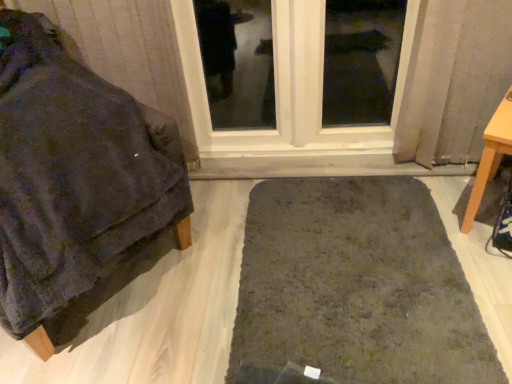
The image size is (512, 384). What do you see at coordinates (355, 286) in the screenshot?
I see `dark green shaggy rug at center` at bounding box center [355, 286].

This screenshot has width=512, height=384. What do you see at coordinates (490, 156) in the screenshot?
I see `light brown wooden table at right, the 2th furniture viewed from the left` at bounding box center [490, 156].

Describe the element at coordinates (73, 179) in the screenshot. I see `velvety dark gray blanket at left, positioned as the second furniture in right-to-left order` at that location.

Find the location of `clear glass window at center`. clear glass window at center is located at coordinates (288, 86).

From a real-world perspective, who is located lower, clear glass window at center or light brown wooden table at right, the 2th furniture viewed from the left?

Answer: light brown wooden table at right, the 2th furniture viewed from the left, is physically lower.

Is clear glass window at center in front of light brown wooden table at right, positioned as the first furniture in right-to-left order?

No, clear glass window at center is further to the viewer.

Considering the relative sizes of clear glass window at center and light brown wooden table at right, positioned as the first furniture in right-to-left order, in the image provided, is clear glass window at center taller than light brown wooden table at right, positioned as the first furniture in right-to-left order,?

Yes.

This screenshot has width=512, height=384. I want to click on window that is above the light brown wooden table at right, positioned as the first furniture in right-to-left order (from a real-world perspective), so click(x=288, y=86).

From the image's perspective, which one is positioned higher, dark green shaggy rug at center or velvety dark gray blanket at left, positioned as the second furniture in right-to-left order?

velvety dark gray blanket at left, positioned as the second furniture in right-to-left order, appears higher in the image.

Which object is thinner, dark green shaggy rug at center or velvety dark gray blanket at left, positioned as the second furniture in right-to-left order?

With smaller width is velvety dark gray blanket at left, positioned as the second furniture in right-to-left order.

Can you confirm if dark green shaggy rug at center is positioned to the right of velvety dark gray blanket at left, which is counted as the first furniture, starting from the left?

Yes.

Locate an element on the screen. Image resolution: width=512 pixels, height=384 pixels. bath mat directly beneath the velvety dark gray blanket at left, positioned as the second furniture in right-to-left order (from a real-world perspective) is located at coordinates (355, 286).

From a real-world perspective, is light brown wooden table at right, the 2th furniture viewed from the left, above or below dark green shaggy rug at center?

light brown wooden table at right, the 2th furniture viewed from the left, is above dark green shaggy rug at center.

Does light brown wooden table at right, the 2th furniture viewed from the left, have a lesser width compared to dark green shaggy rug at center?

Indeed, light brown wooden table at right, the 2th furniture viewed from the left, has a lesser width compared to dark green shaggy rug at center.

Is light brown wooden table at right, the 2th furniture viewed from the left, directly adjacent to dark green shaggy rug at center?

No, light brown wooden table at right, the 2th furniture viewed from the left, is not beside dark green shaggy rug at center.

Can you tell me how much light brown wooden table at right, the 2th furniture viewed from the left, and dark green shaggy rug at center differ in facing direction?

There is a 30.8-degree angle between the facing directions of light brown wooden table at right, the 2th furniture viewed from the left, and dark green shaggy rug at center.

Is dark green shaggy rug at center inside velvety dark gray blanket at left, positioned as the second furniture in right-to-left order?

No, dark green shaggy rug at center is not a part of velvety dark gray blanket at left, positioned as the second furniture in right-to-left order.

From the image's perspective, is velvety dark gray blanket at left, positioned as the second furniture in right-to-left order, beneath dark green shaggy rug at center?

No.

Identify the location of bath mat that appears behind the velvety dark gray blanket at left, positioned as the second furniture in right-to-left order. This screenshot has height=384, width=512. (355, 286).

Which is behind, point (38, 43) or point (399, 185)?

Positioned behind is point (399, 185).

In terms of size, does velvety dark gray blanket at left, positioned as the second furniture in right-to-left order, appear bigger or smaller than clear glass window at center?

Considering their sizes, velvety dark gray blanket at left, positioned as the second furniture in right-to-left order, takes up more space than clear glass window at center.

Can you confirm if velvety dark gray blanket at left, positioned as the second furniture in right-to-left order, is thinner than clear glass window at center?

Incorrect, the width of velvety dark gray blanket at left, positioned as the second furniture in right-to-left order, is not less than that of clear glass window at center.

From the image's perspective, between velvety dark gray blanket at left, which is counted as the first furniture, starting from the left, and clear glass window at center, which one is located above?

clear glass window at center.

What are the coordinates of `window on the left of dark green shaggy rug at center` in the screenshot? It's located at (288, 86).

Does point (276, 133) appear closer or farther from the camera than point (430, 340)?

Point (276, 133).

From the image's perspective, is clear glass window at center on dark green shaggy rug at center?

Indeed, from the image's perspective, clear glass window at center is shown above dark green shaggy rug at center.

Does clear glass window at center have a lesser width compared to dark green shaggy rug at center?

Yes, clear glass window at center is thinner than dark green shaggy rug at center.

From a real-world perspective, is light brown wooden table at right, the 2th furniture viewed from the left, physically located above or below clear glass window at center?

light brown wooden table at right, the 2th furniture viewed from the left, is below clear glass window at center.

Between light brown wooden table at right, positioned as the first furniture in right-to-left order, and clear glass window at center, which one has larger size?

Bigger between the two is clear glass window at center.

Does light brown wooden table at right, positioned as the first furniture in right-to-left order, turn towards clear glass window at center?

No.

Locate an element on the screen. the 1st furniture in front when counting from the clear glass window at center is located at coordinates (490, 156).

I want to click on bath mat below the velvety dark gray blanket at left, positioned as the second furniture in right-to-left order (from a real-world perspective), so click(x=355, y=286).

Estimate the real-world distances between objects in this image. Which object is further from clear glass window at center, dark green shaggy rug at center or velvety dark gray blanket at left, positioned as the second furniture in right-to-left order?

velvety dark gray blanket at left, positioned as the second furniture in right-to-left order, is positioned further to the anchor clear glass window at center.

Estimate the real-world distances between objects in this image. Which object is closer to clear glass window at center, velvety dark gray blanket at left, positioned as the second furniture in right-to-left order, or light brown wooden table at right, the 2th furniture viewed from the left?

Based on the image, velvety dark gray blanket at left, positioned as the second furniture in right-to-left order, appears to be nearer to clear glass window at center.

Based on their spatial positions, is light brown wooden table at right, the 2th furniture viewed from the left, or clear glass window at center closer to velvety dark gray blanket at left, positioned as the second furniture in right-to-left order?

Based on the image, clear glass window at center appears to be nearer to velvety dark gray blanket at left, positioned as the second furniture in right-to-left order.

Consider the image. From the image, which object appears to be farther from dark green shaggy rug at center, clear glass window at center or velvety dark gray blanket at left, which is counted as the first furniture, starting from the left?

Among the two, clear glass window at center is located further to dark green shaggy rug at center.

When comparing their distances from dark green shaggy rug at center, does velvety dark gray blanket at left, which is counted as the first furniture, starting from the left, or clear glass window at center seem closer?

velvety dark gray blanket at left, which is counted as the first furniture, starting from the left, is closer to dark green shaggy rug at center.

Looking at the image, which one is located closer to clear glass window at center, light brown wooden table at right, the 2th furniture viewed from the left, or velvety dark gray blanket at left, which is counted as the first furniture, starting from the left?

Among the two, velvety dark gray blanket at left, which is counted as the first furniture, starting from the left, is located nearer to clear glass window at center.

When comparing their distances from dark green shaggy rug at center, does velvety dark gray blanket at left, positioned as the second furniture in right-to-left order, or light brown wooden table at right, the 2th furniture viewed from the left, seem closer?

Among the two, light brown wooden table at right, the 2th furniture viewed from the left, is located nearer to dark green shaggy rug at center.

Considering their positions, is velvety dark gray blanket at left, positioned as the second furniture in right-to-left order, positioned closer to clear glass window at center than dark green shaggy rug at center?

Based on the image, dark green shaggy rug at center appears to be nearer to clear glass window at center.

Locate an element on the screen. The height and width of the screenshot is (384, 512). window between velvety dark gray blanket at left, which is counted as the first furniture, starting from the left, and dark green shaggy rug at center is located at coordinates (288, 86).

You are a GUI agent. You are given a task and a screenshot of the screen. Output one action in this format:
    pyautogui.click(x=<x>, y=<y>)
    Task: Click on the bath mat located between velvety dark gray blanket at left, which is counted as the first furniture, starting from the left, and light brown wooden table at right, the 2th furniture viewed from the left, in the left-right direction
    Image resolution: width=512 pixels, height=384 pixels.
    Given the screenshot: What is the action you would take?
    pyautogui.click(x=355, y=286)

Locate an element on the screen. The height and width of the screenshot is (384, 512). bath mat between clear glass window at center and light brown wooden table at right, positioned as the first furniture in right-to-left order is located at coordinates (355, 286).

Where is `window situated between velvety dark gray blanket at left, which is counted as the first furniture, starting from the left, and light brown wooden table at right, the 2th furniture viewed from the left, from left to right`? The width and height of the screenshot is (512, 384). window situated between velvety dark gray blanket at left, which is counted as the first furniture, starting from the left, and light brown wooden table at right, the 2th furniture viewed from the left, from left to right is located at coordinates (288, 86).